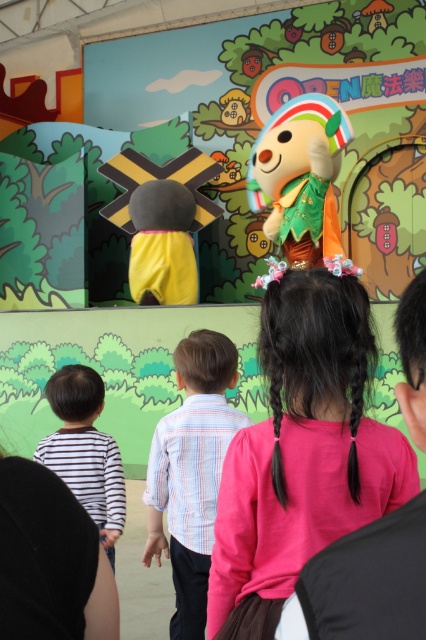
You are a photographer at the event and want to capture a clear shot of the striped cotton shirt at center without the pink fabric at center blocking it. What should you do?

Move the camera position backward so that the striped cotton shirt at center is no longer behind the pink fabric at center.

You are a photographer trying to capture a photo of the soft plush toy at center without the striped cotton shirt at center blocking it. Where should you move relative to the current position?

The striped cotton shirt at center is positioned on the left side of the soft plush toy at center. To avoid the striped cotton shirt at center blocking the view, move to the right side of the soft plush toy at center.